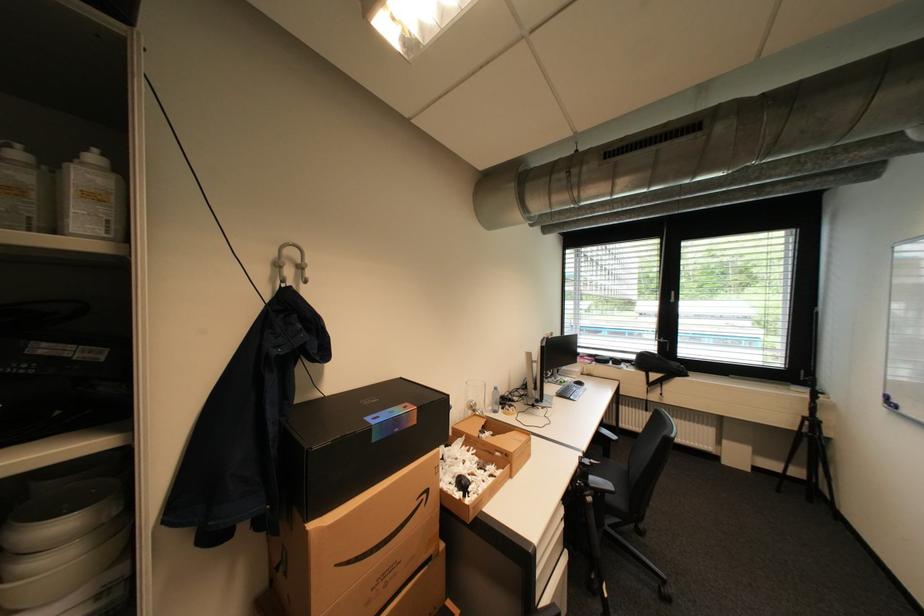
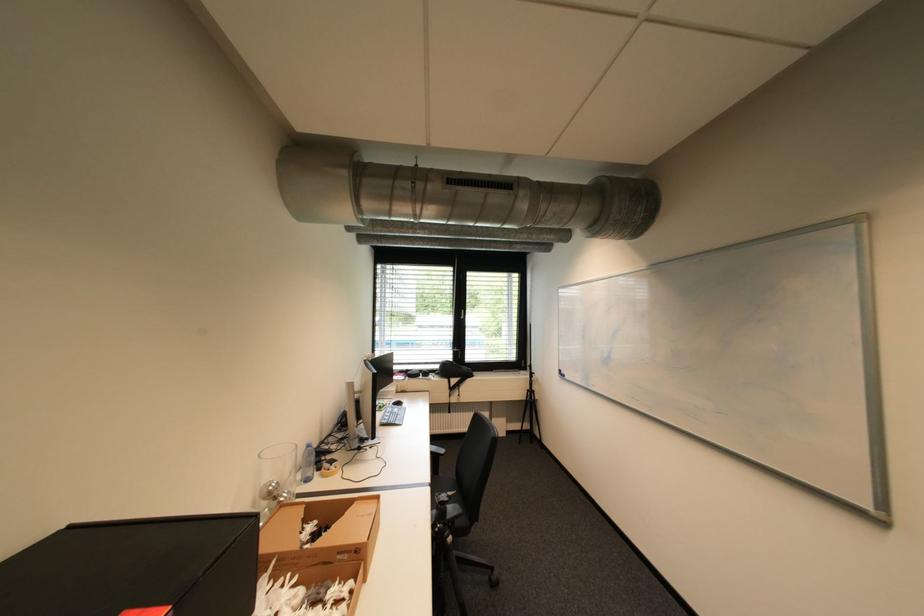
Where in the second image is the point corresponding to [681,293] from the first image?

(470, 312)